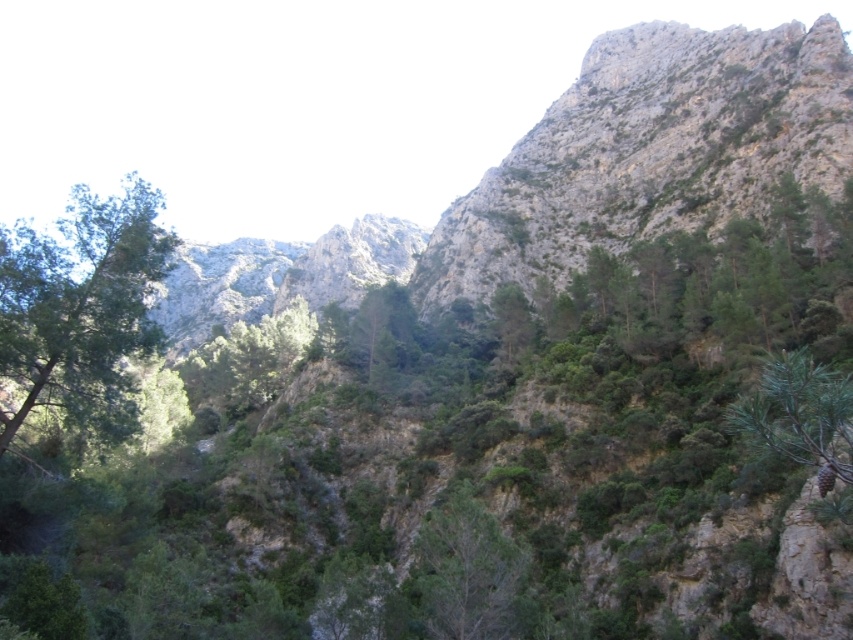
You are a hiker standing at the base of the rugged stone mountain at upper right. You want to reach the summit. Given that the mountain is 90.17 meters away from you, can you estimate how long it might take to climb it?

The rugged stone mountain at upper right is 90.17 meters away from the viewer. However, the distance to the summit isn not provided, so the time required to climb cannot be accurately estimated based on the given information.

You are standing at the base of the rugged stone mountain at upper right and want to walk to the green leafy tree at center. In which direction should you head to reach the tree?

The rugged stone mountain at upper right is to the right of the green leafy tree at center, so you should head to the left to reach the tree.